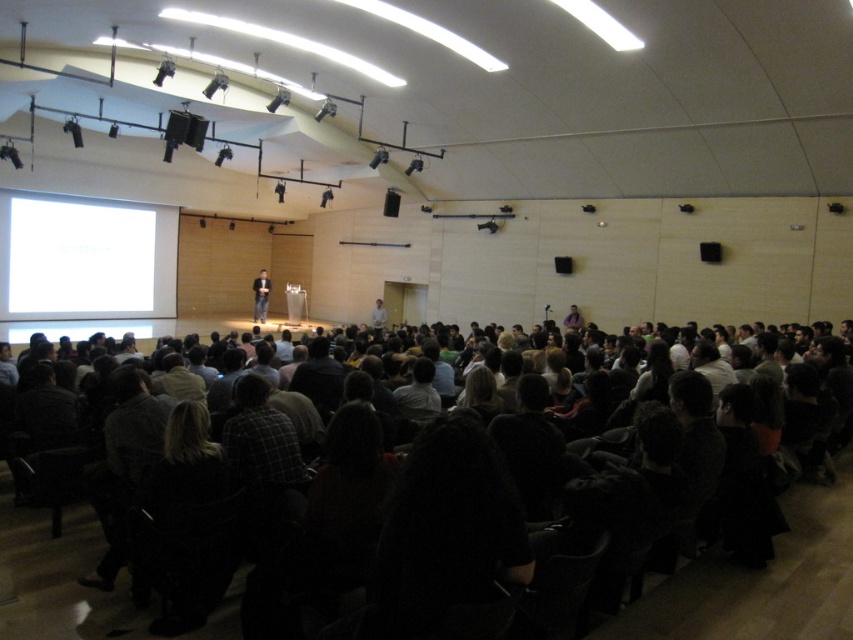
You are sitting in the auditorium and want to determine the relative positions of two points marked in the image. Which point is closer to the audience, point (x=787, y=538) or point (x=3, y=310)?

Point (x=787, y=538) is in front of point (x=3, y=310), so it is closer to the audience.

You are sitting at the back of the auditorium and want to see the presentation on the white glossy projection screen at left. However, there is a dark clothing crowd at center blocking your view. Can you see the screen clearly from your current position?

The dark clothing crowd at center has a lesser height compared to the white glossy projection screen at left, so you can likely see the screen over their heads as long as they aren not sitting in front of you.

You are sitting in the auditorium and want to see the presentation clearly. The presenter is standing at the podium, and there is a dark clothing crowd at center represented by point (x=759, y=580). Is the presenter closer to the podium or the dark clothing crowd at center?

The presenter is standing at the podium, so they are closer to the podium than the dark clothing crowd at center represented by point (x=759, y=580).